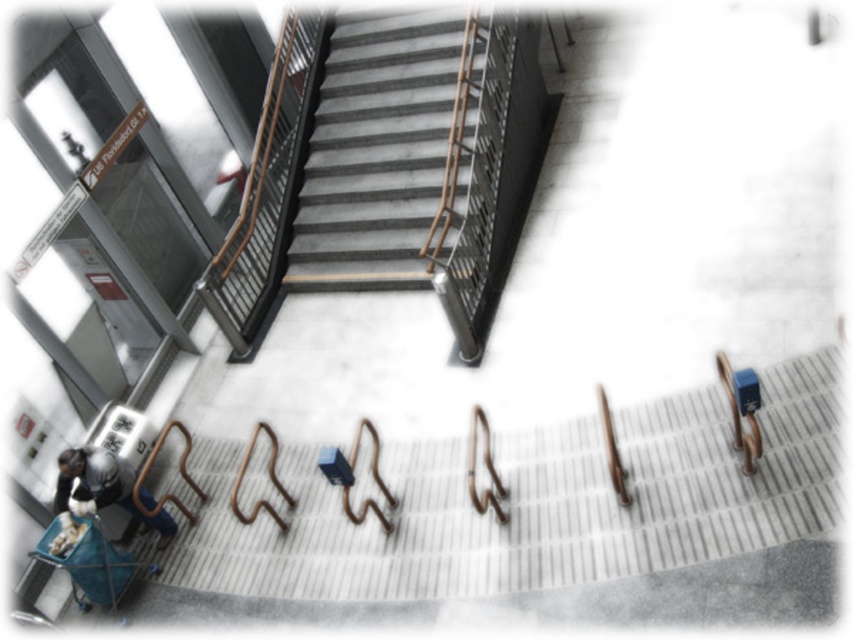
Question: Among these objects, which one is nearest to the camera?

Choices:
 (A) dark gray fabric bag at lower left
 (B) gray concrete stairs at center

Answer: (A)

Question: Among these points, which one is farthest from the camera?

Choices:
 (A) (67, 502)
 (B) (430, 58)

Answer: (B)

Question: Which object is farther from the camera taking this photo?

Choices:
 (A) gray concrete stairs at center
 (B) dark gray fabric bag at lower left

Answer: (A)

Question: Can you confirm if gray concrete stairs at center is positioned above dark gray fabric bag at lower left?

Choices:
 (A) yes
 (B) no

Answer: (A)

Question: Is gray concrete stairs at center positioned at the back of dark gray fabric bag at lower left?

Choices:
 (A) no
 (B) yes

Answer: (B)

Question: Where is gray concrete stairs at center located in relation to dark gray fabric bag at lower left in the image?

Choices:
 (A) below
 (B) above

Answer: (B)